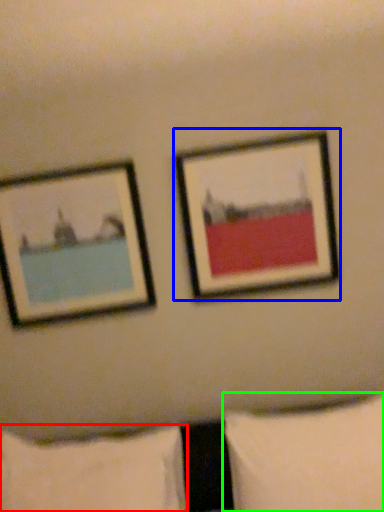
Question: Estimate the real-world distances between objects in this image. Which object is farther from pillow (highlighted by a red box), picture frame (highlighted by a blue box) or pillow (highlighted by a green box)?

Choices:
 (A) picture frame
 (B) pillow

Answer: (A)